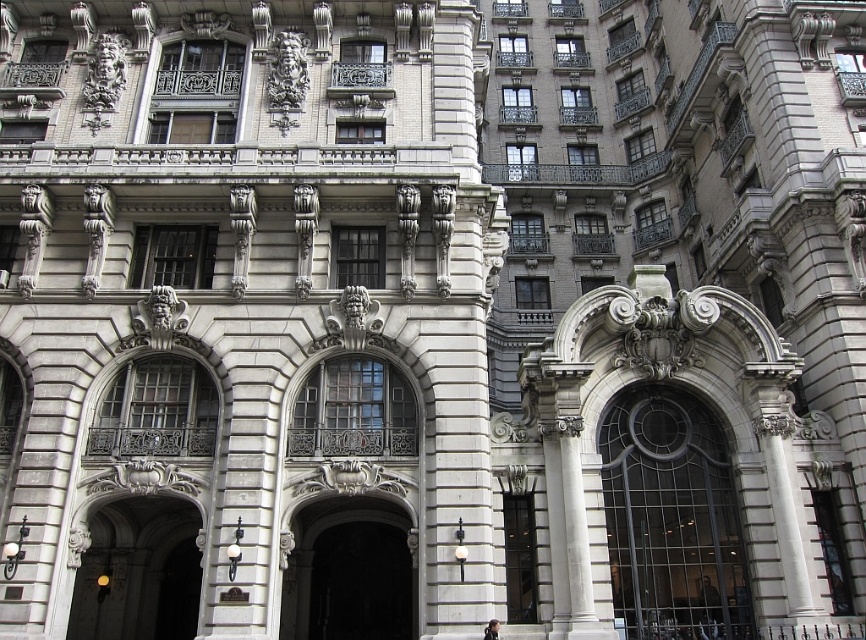
Does black glass door at center have a greater height compared to dark gray stone archway at center?

Indeed, black glass door at center has a greater height compared to dark gray stone archway at center.

Is point (684, 593) positioned in front of point (370, 586)?

Yes, it is.

Is point (695, 410) closer to viewer compared to point (340, 525)?

Yes, point (695, 410) is in front of point (340, 525).

The height and width of the screenshot is (640, 866). In order to click on black glass door at center in this screenshot , I will do `click(671, 518)`.

Describe the element at coordinates (671, 518) in the screenshot. Image resolution: width=866 pixels, height=640 pixels. I see `black glass door at center` at that location.

What are the coordinates of `black glass door at center` in the screenshot? It's located at (671, 518).

Measure the distance between black glass door at center and camera.

black glass door at center and camera are 49.49 meters apart from each other.

Image resolution: width=866 pixels, height=640 pixels. In order to click on black glass door at center in this screenshot , I will do `click(671, 518)`.

Does dark gray stone archway at center have a smaller size compared to polished bronze door at center?

Correct, dark gray stone archway at center occupies less space than polished bronze door at center.

What do you see at coordinates (349, 572) in the screenshot? This screenshot has width=866, height=640. I see `dark gray stone archway at center` at bounding box center [349, 572].

Does point (339, 621) lie in front of point (127, 544)?

No, (339, 621) is further to viewer.

In order to click on dark gray stone archway at center in this screenshot , I will do `click(349, 572)`.